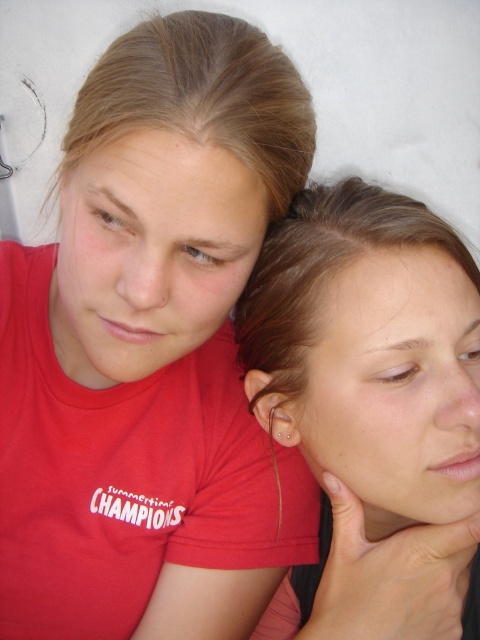
Question: Which point is farther to the camera?

Choices:
 (A) coord(448,456)
 (B) coord(96,436)

Answer: (B)

Question: Does matte red t-shirt at upper left have a lesser width compared to brown hair at upper right?

Choices:
 (A) no
 (B) yes

Answer: (A)

Question: Among these points, which one is farthest from the camera?

Choices:
 (A) (96, 333)
 (B) (394, 381)

Answer: (A)

Question: Considering the relative positions of matte red t-shirt at upper left and brown hair at upper right in the image provided, where is matte red t-shirt at upper left located with respect to brown hair at upper right?

Choices:
 (A) left
 (B) right

Answer: (A)

Question: Can you confirm if matte red t-shirt at upper left is smaller than brown hair at upper right?

Choices:
 (A) no
 (B) yes

Answer: (A)